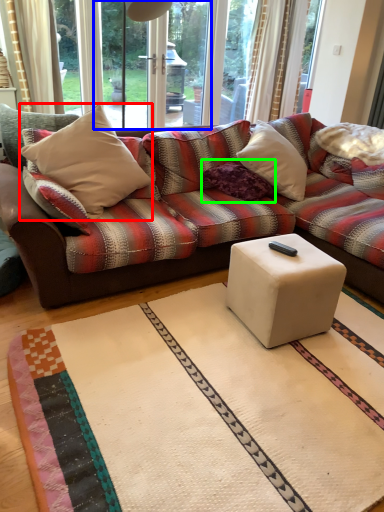
Question: Considering the real-world distances, which object is farthest from throw pillow (highlighted by a red box)? screen door (highlighted by a blue box) or pillow (highlighted by a green box)?

Choices:
 (A) screen door
 (B) pillow

Answer: (A)